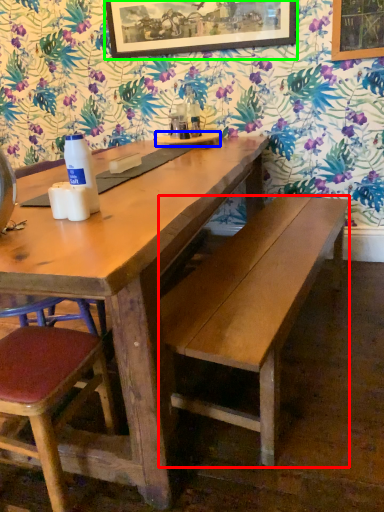
Question: Which is farther away from bench (highlighted by a red box)? plate (highlighted by a blue box) or picture frame (highlighted by a green box)?

Choices:
 (A) plate
 (B) picture frame

Answer: (B)